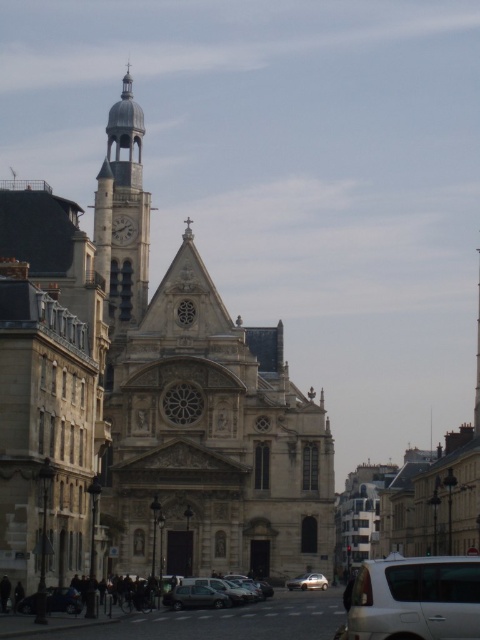
Question: Can you confirm if polished brass clock tower at upper left is wider than metallic silver car at lower left?

Choices:
 (A) yes
 (B) no

Answer: (A)

Question: Can you confirm if metallic silver car at center is smaller than dark gray metallic car at center?

Choices:
 (A) yes
 (B) no

Answer: (B)

Question: Which point appears farthest from the camera in this image?

Choices:
 (A) (192, 595)
 (B) (313, 586)
 (C) (389, 595)

Answer: (B)

Question: Which object is positioned closest to the metallic silver car at lower left?

Choices:
 (A) polished brass clock tower at upper left
 (B) metallic silver car at center

Answer: (B)

Question: Which object is the closest to the dark gray metallic car at center?

Choices:
 (A) metallic silver car at lower left
 (B) polished brass clock tower at upper left
 (C) white matte car at lower right

Answer: (A)

Question: Observing the image, what is the correct spatial positioning of polished brass clock tower at upper left in reference to dark gray metallic car at center?

Choices:
 (A) above
 (B) below

Answer: (A)